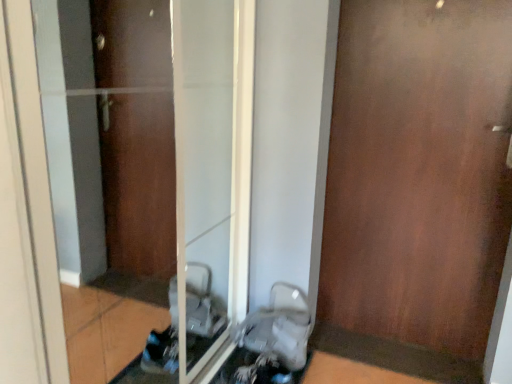
Question: Considering the positions of point (498, 233) and point (172, 29), is point (498, 233) closer or farther from the camera than point (172, 29)?

Choices:
 (A) farther
 (B) closer

Answer: (B)

Question: In terms of height, does brown wood door at right look taller or shorter compared to transparent glass door at center?

Choices:
 (A) short
 (B) tall

Answer: (B)

Question: Based on their relative distances, which object is farther from the transparent glass door at center?

Choices:
 (A) brown wood door at right
 (B) white plastic baby carriage at lower center

Answer: (A)

Question: Which of these objects is positioned closest to the transparent glass door at center?

Choices:
 (A) white plastic baby carriage at lower center
 (B) brown wood door at right

Answer: (A)